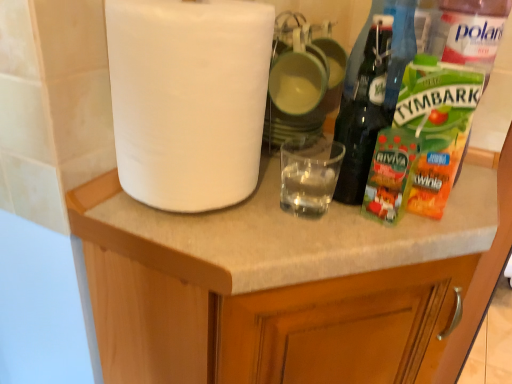
Question: From a real-world perspective, is white matte cabinet at upper left on top of white matte paper towel at upper left?

Choices:
 (A) no
 (B) yes

Answer: (A)

Question: Considering the relative sizes of white matte cabinet at upper left and white matte paper towel at upper left in the image provided, is white matte cabinet at upper left wider than white matte paper towel at upper left?

Choices:
 (A) no
 (B) yes

Answer: (B)

Question: From the image's perspective, is white matte cabinet at upper left on top of white matte paper towel at upper left?

Choices:
 (A) no
 (B) yes

Answer: (A)

Question: Considering the relative positions of white matte cabinet at upper left and white matte paper towel at upper left in the image provided, is white matte cabinet at upper left behind white matte paper towel at upper left?

Choices:
 (A) yes
 (B) no

Answer: (B)

Question: Would you say white matte cabinet at upper left is a long distance from white matte paper towel at upper left?

Choices:
 (A) no
 (B) yes

Answer: (A)

Question: Is white matte cabinet at upper left facing away from white matte paper towel at upper left?

Choices:
 (A) yes
 (B) no

Answer: (B)

Question: Is white matte paper towel at upper left oriented towards white matte cabinet at upper left?

Choices:
 (A) no
 (B) yes

Answer: (A)

Question: Can you confirm if white matte paper towel at upper left is shorter than white matte cabinet at upper left?

Choices:
 (A) no
 (B) yes

Answer: (B)

Question: Is white matte paper towel at upper left wider than white matte cabinet at upper left?

Choices:
 (A) yes
 (B) no

Answer: (B)

Question: Is white matte paper towel at upper left directly adjacent to white matte cabinet at upper left?

Choices:
 (A) no
 (B) yes

Answer: (A)

Question: Is white matte paper towel at upper left to the left of white matte cabinet at upper left from the viewer's perspective?

Choices:
 (A) yes
 (B) no

Answer: (A)

Question: Is white matte paper towel at upper left completely or partially outside of white matte cabinet at upper left?

Choices:
 (A) yes
 (B) no

Answer: (A)

Question: From the image's perspective, is white matte cabinet at upper left located above or below white matte paper towel at upper left?

Choices:
 (A) above
 (B) below

Answer: (B)